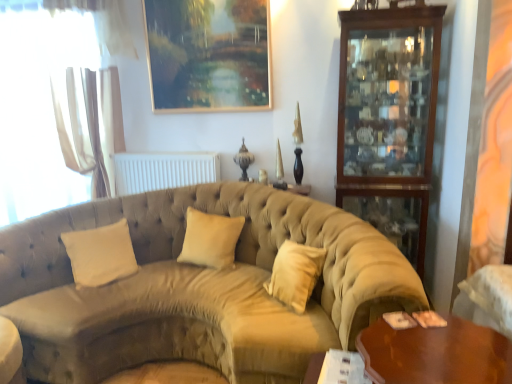
Question: From the image's perspective, is white matte radiator at center beneath mahogany wood cabinet at right?

Choices:
 (A) yes
 (B) no

Answer: (A)

Question: Can you confirm if white matte radiator at center is thinner than mahogany wood cabinet at right?

Choices:
 (A) no
 (B) yes

Answer: (B)

Question: Is white matte radiator at center closer to the viewer compared to mahogany wood cabinet at right?

Choices:
 (A) no
 (B) yes

Answer: (A)

Question: Considering the relative positions of white matte radiator at center and mahogany wood cabinet at right in the image provided, is white matte radiator at center behind mahogany wood cabinet at right?

Choices:
 (A) yes
 (B) no

Answer: (A)

Question: From a real-world perspective, is white matte radiator at center under mahogany wood cabinet at right?

Choices:
 (A) yes
 (B) no

Answer: (A)

Question: In terms of height, does mahogany wood cabinet at right look taller or shorter compared to beige fabric pillow at center, the 2th pillow viewed from the left?

Choices:
 (A) tall
 (B) short

Answer: (A)

Question: From a real-world perspective, is mahogany wood cabinet at right physically located above or below beige fabric pillow at center, the 2th pillow viewed from the left?

Choices:
 (A) above
 (B) below

Answer: (A)

Question: Looking at their shapes, would you say mahogany wood cabinet at right is wider or thinner than beige fabric pillow at center, the 2th pillow viewed from the left?

Choices:
 (A) wide
 (B) thin

Answer: (A)

Question: From the image's perspective, relative to beige fabric pillow at center, the 1th pillow from the right, is mahogany wood cabinet at right above or below?

Choices:
 (A) above
 (B) below

Answer: (A)

Question: In the image, is white matte radiator at center positioned in front of or behind white fabric armchair at lower right?

Choices:
 (A) behind
 (B) front

Answer: (A)

Question: From the image's perspective, relative to white fabric armchair at lower right, is white matte radiator at center above or below?

Choices:
 (A) above
 (B) below

Answer: (A)

Question: Is white matte radiator at center inside or outside of white fabric armchair at lower right?

Choices:
 (A) inside
 (B) outside

Answer: (B)

Question: Is point (132, 185) closer or farther from the camera than point (462, 294)?

Choices:
 (A) farther
 (B) closer

Answer: (A)

Question: Based on their sizes in the image, would you say shiny brown wooden table at lower right is bigger or smaller than mahogany wood cabinet at right?

Choices:
 (A) small
 (B) big

Answer: (A)

Question: From the image's perspective, is shiny brown wooden table at lower right above or below mahogany wood cabinet at right?

Choices:
 (A) below
 (B) above

Answer: (A)